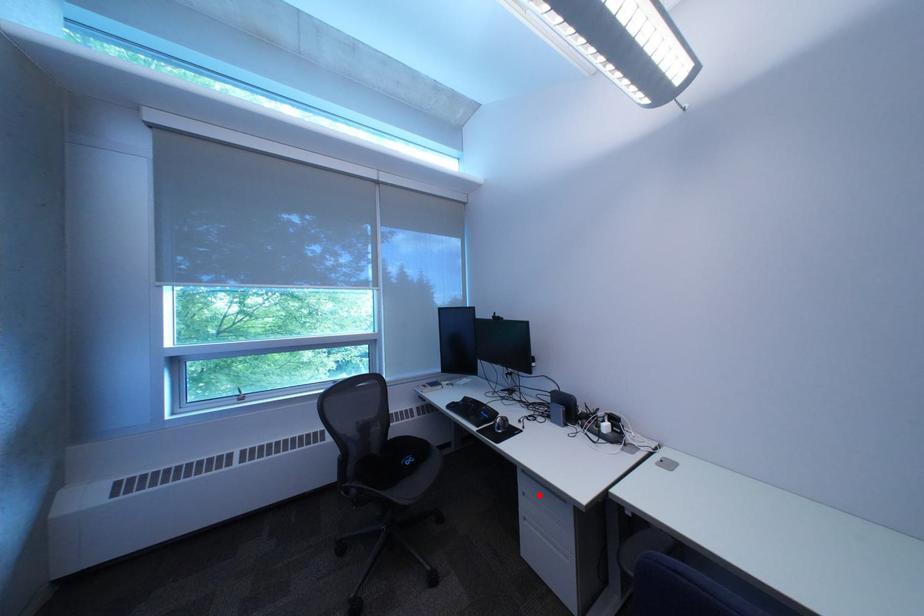
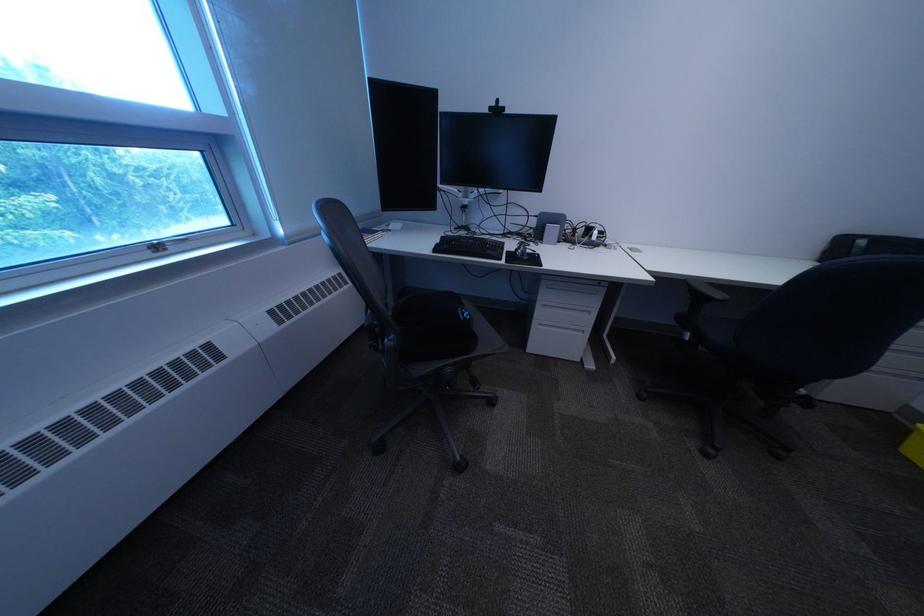
Question: I am providing you with two images of the same scene from different viewpoints. A red point is shown in image1. For the corresponding object point in image2, is it positioned nearer or farther from the camera?

Choices:
 (A) Nearer
 (B) Farther

Answer: (A)